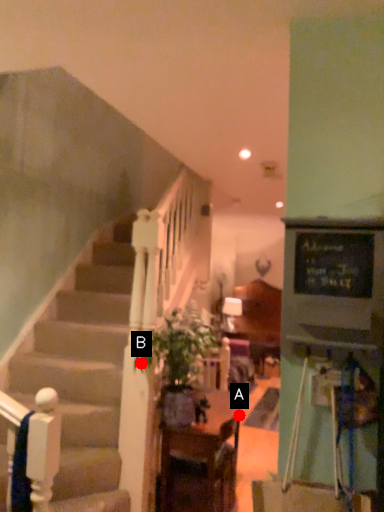
Question: Two points are circled on the image, labeled by A and B beside each circle. Among these points, which one is farthest from the camera?

Choices:
 (A) A is further
 (B) B is further

Answer: (A)